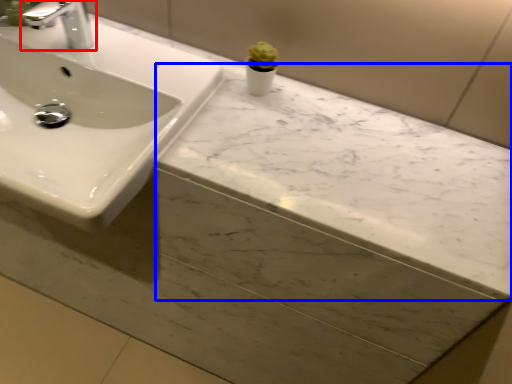
Question: Which object appears closest to the camera in this image, tap (highlighted by a red box) or counter top (highlighted by a blue box)?

Choices:
 (A) tap
 (B) counter top

Answer: (B)